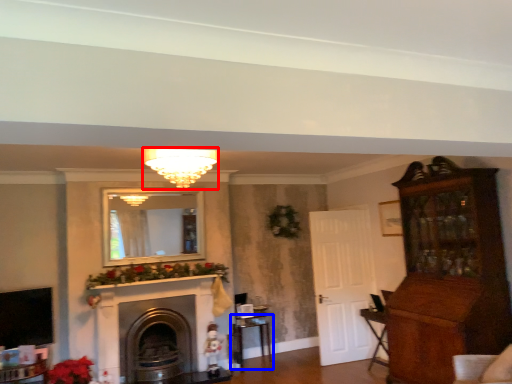
Question: Which object is further to the camera taking this photo, light fixture (highlighted by a red box) or table (highlighted by a blue box)?

Choices:
 (A) light fixture
 (B) table

Answer: (B)